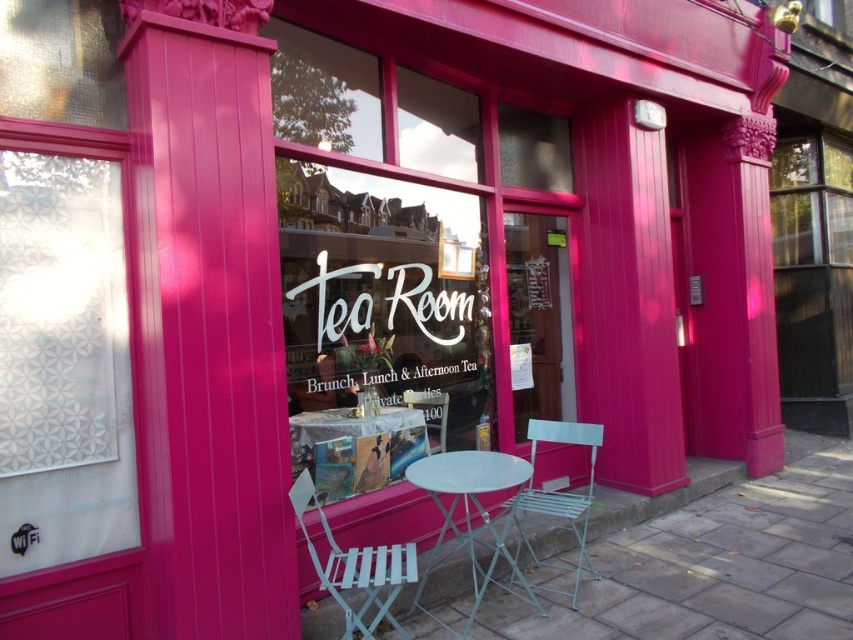
Question: Which of these objects is positioned closest to the metallic teal chair at lower center?

Choices:
 (A) metallic silver table at center
 (B) metallic silver chair at center

Answer: (A)

Question: Does white plastic table at center have a smaller size compared to metallic teal chair at lower center?

Choices:
 (A) yes
 (B) no

Answer: (A)

Question: Does white plastic table at center appear under metallic teal chair at lower center?

Choices:
 (A) no
 (B) yes

Answer: (A)

Question: Which point is closer to the camera taking this photo?

Choices:
 (A) (572, 438)
 (B) (444, 470)

Answer: (B)

Question: Among these objects, which one is farthest from the camera?

Choices:
 (A) metallic silver table at center
 (B) white plastic table at center

Answer: (B)

Question: Can you confirm if white plastic table at center is positioned to the left of white striped fabric chair at lower center?

Choices:
 (A) no
 (B) yes

Answer: (A)